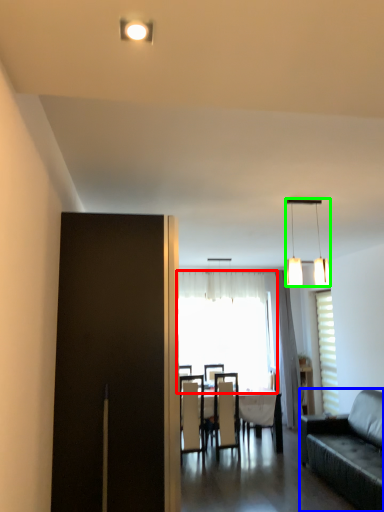
Question: Which is farther away from window (highlighted by a red box)? studio couch (highlighted by a blue box) or lamp (highlighted by a green box)?

Choices:
 (A) studio couch
 (B) lamp

Answer: (B)